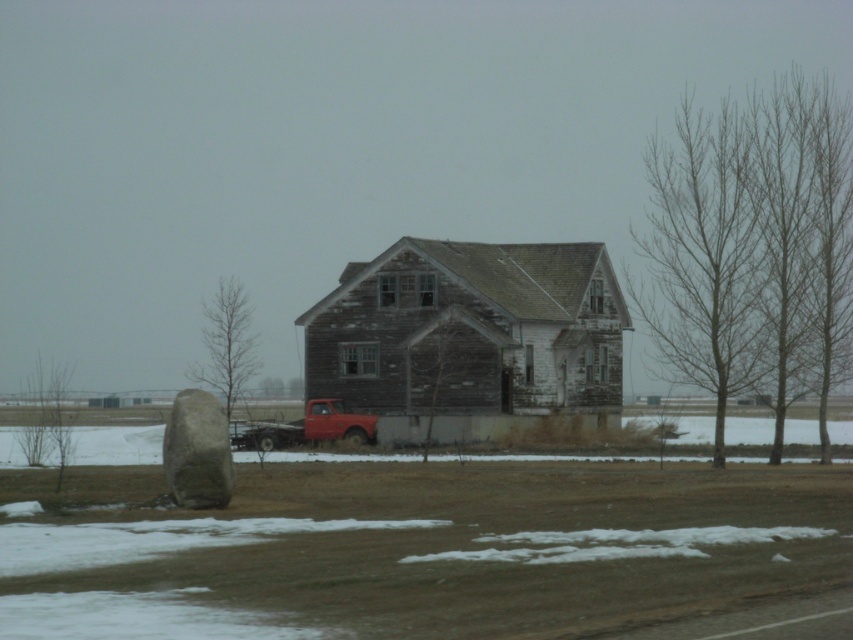
Between weathered wood barn at center and smooth gray rock at lower left, which one is positioned higher?

weathered wood barn at center

Measure the distance from weathered wood barn at center to smooth gray rock at lower left.

weathered wood barn at center and smooth gray rock at lower left are 113.69 feet apart from each other.

The image size is (853, 640). Describe the element at coordinates (469, 337) in the screenshot. I see `weathered wood barn at center` at that location.

At what (x,y) coordinates should I click in order to perform the action: click on weathered wood barn at center. Please return your answer as a coordinate pair (x, y). Looking at the image, I should click on (469, 337).

Does weathered wood barn at center have a greater width compared to matte red truck at center?

Yes.

Measure the distance between point (x=422, y=333) and camera.

59.01 meters

The image size is (853, 640). Identify the location of weathered wood barn at center. (469, 337).

Does smooth gray rock at lower left appear over matte red truck at center?

Correct, smooth gray rock at lower left is located above matte red truck at center.

Measure the distance from smooth gray rock at lower left to matte red truck at center.

smooth gray rock at lower left is 31.83 meters from matte red truck at center.

Is point (200, 464) farther from camera compared to point (299, 424)?

No.

At what (x,y) coordinates should I click in order to perform the action: click on smooth gray rock at lower left. Please return your answer as a coordinate pair (x, y). Looking at the image, I should click on (196, 451).